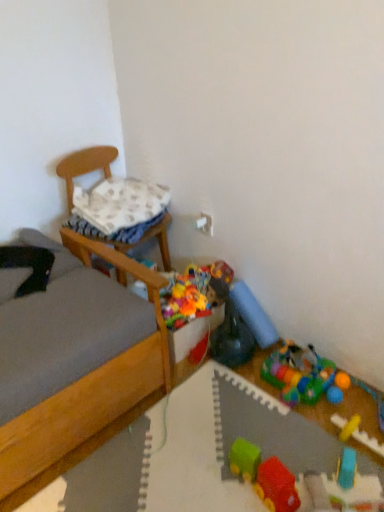
Locate an element on the screen. This screenshot has height=512, width=384. vacant area that lies to the right of blue rubber toy at lower right, which is the fourth toy in back-to-front order is located at coordinates (373, 465).